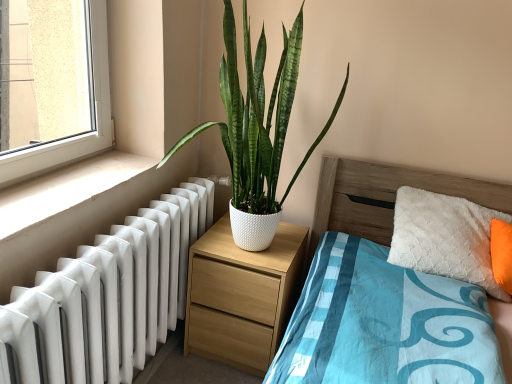
Question: Is white smooth window sill at lower left taller than white glossy radiator at left?

Choices:
 (A) yes
 (B) no

Answer: (B)

Question: Could white glossy radiator at left be considered to be inside white smooth window sill at lower left?

Choices:
 (A) yes
 (B) no

Answer: (B)

Question: From the image's perspective, is white smooth window sill at lower left beneath white glossy radiator at left?

Choices:
 (A) no
 (B) yes

Answer: (A)

Question: From a real-world perspective, is white smooth window sill at lower left on top of white glossy radiator at left?

Choices:
 (A) no
 (B) yes

Answer: (B)

Question: Does white smooth window sill at lower left have a greater width compared to white glossy radiator at left?

Choices:
 (A) no
 (B) yes

Answer: (A)

Question: In the image, is wooden bed at center positioned in front of or behind white glossy radiator at left?

Choices:
 (A) front
 (B) behind

Answer: (A)

Question: In the image, is wooden bed at center on the left side or the right side of white glossy radiator at left?

Choices:
 (A) right
 (B) left

Answer: (A)

Question: Considering the positions of point (477, 180) and point (124, 226), is point (477, 180) closer or farther from the camera than point (124, 226)?

Choices:
 (A) farther
 (B) closer

Answer: (A)

Question: From their relative heights in the image, would you say wooden bed at center is taller or shorter than white glossy radiator at left?

Choices:
 (A) tall
 (B) short

Answer: (A)

Question: Which is correct: white glossy radiator at left is inside wooden bed at center, or outside of it?

Choices:
 (A) inside
 (B) outside

Answer: (B)

Question: From the image's perspective, is white glossy radiator at left positioned above or below wooden bed at center?

Choices:
 (A) below
 (B) above

Answer: (B)

Question: Based on their sizes in the image, would you say white glossy radiator at left is bigger or smaller than wooden bed at center?

Choices:
 (A) small
 (B) big

Answer: (A)

Question: Considering their positions, is white glossy radiator at left located in front of or behind wooden bed at center?

Choices:
 (A) behind
 (B) front

Answer: (A)

Question: Is white textured pot at center to the left or to the right of light wood/texture nightstand at center in the image?

Choices:
 (A) left
 (B) right

Answer: (B)

Question: Looking at their shapes, would you say white textured pot at center is wider or thinner than light wood/texture nightstand at center?

Choices:
 (A) thin
 (B) wide

Answer: (B)